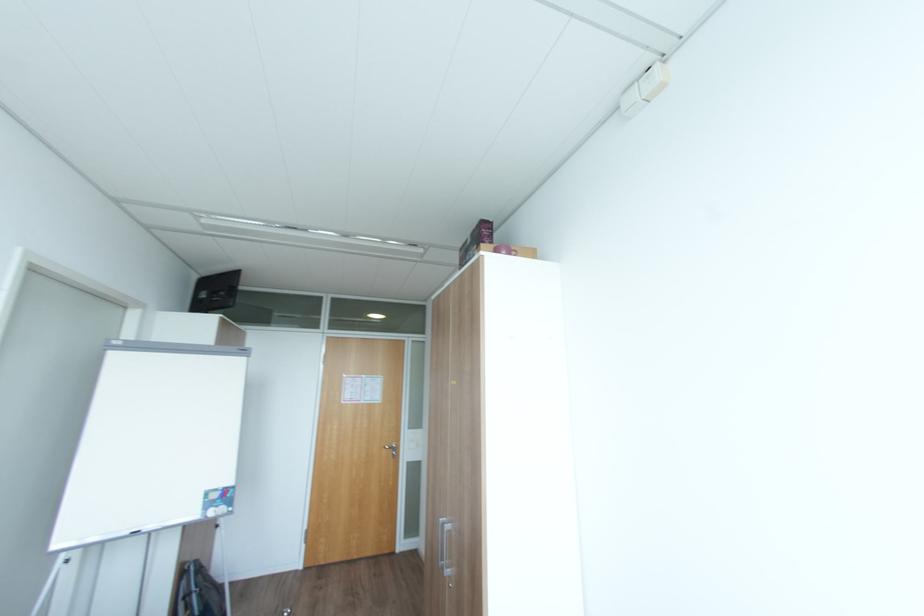
This screenshot has height=616, width=924. What do you see at coordinates (511, 249) in the screenshot?
I see `the brown cardboard box` at bounding box center [511, 249].